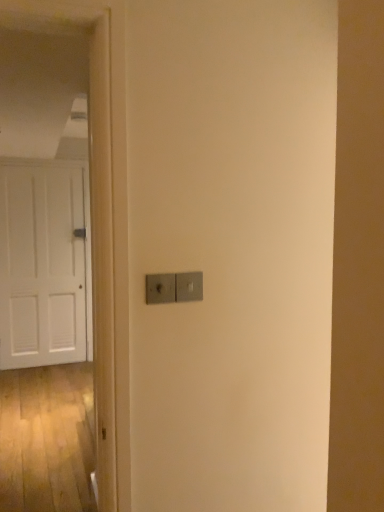
Question: Is point (193, 287) closer or farther from the camera than point (28, 176)?

Choices:
 (A) closer
 (B) farther

Answer: (A)

Question: Is satin silver switch at center, which appears as the first light switch when viewed from the right, taller or shorter than white matte door at left?

Choices:
 (A) tall
 (B) short

Answer: (B)

Question: Based on their relative distances, which object is farther from the white matte door at left?

Choices:
 (A) satin silver switch at center, which is counted as the 2th light switch, starting from the left
 (B) satin silver switch at center, which ranks as the first light switch in left-to-right order

Answer: (A)

Question: Considering the real-world distances, which object is farthest from the satin silver switch at center, which ranks as the first light switch in left-to-right order?

Choices:
 (A) white matte door at left
 (B) satin silver switch at center, which appears as the first light switch when viewed from the right

Answer: (A)